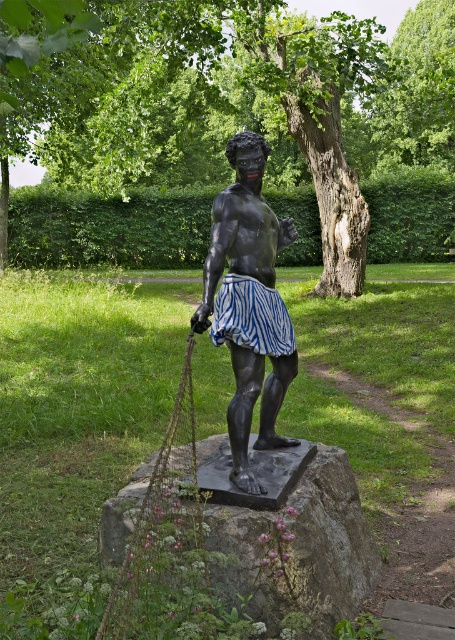
Can you confirm if green textured tree at center is positioned below black polished statue at center?

Incorrect, green textured tree at center is not positioned below black polished statue at center.

Which is in front, point (429, 243) or point (211, 310)?

Point (211, 310) is in front.

Does point (424, 13) come behind point (246, 212)?

Yes, point (424, 13) is farther from viewer.

You are a GUI agent. You are given a task and a screenshot of the screen. Output one action in this format:
    pyautogui.click(x=<x>, y=<y>)
    Task: Click on the green textured tree at center
    Image resolution: width=455 pixels, height=640 pixels.
    Given the screenshot: What is the action you would take?
    pyautogui.click(x=263, y=116)

Which of these two, green textured tree at center or green leafy tree at upper center, stands shorter?

green leafy tree at upper center

Which is behind, point (312, 125) or point (377, 163)?

The point (377, 163) is more distant.

Is point (423, 156) closer to viewer compared to point (382, 81)?

No, it is not.

The height and width of the screenshot is (640, 455). Identify the location of green textured tree at center. (263, 116).

Does point (328, 552) lie in front of point (372, 134)?

Yes, it is in front of point (372, 134).

Find the location of a particular element. This screenshot has width=455, height=640. dark gray stone at center is located at coordinates (288, 534).